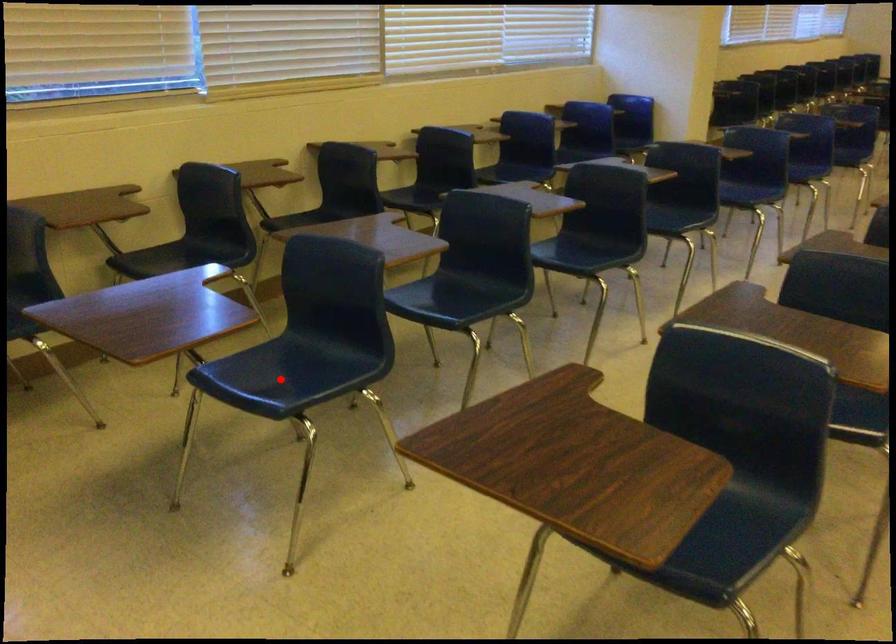
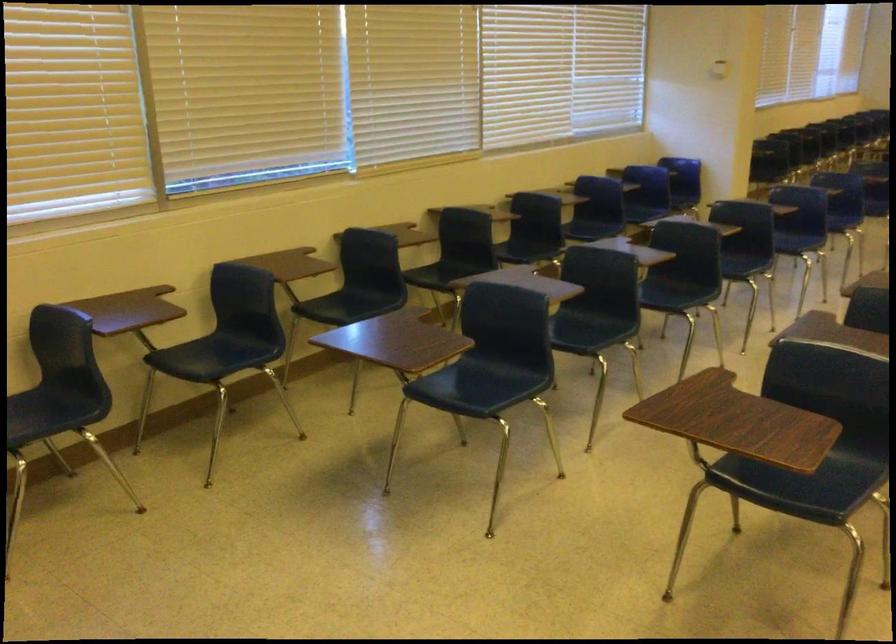
In the second image, find the point that corresponds to the highlighted location in the first image.

(467, 386)